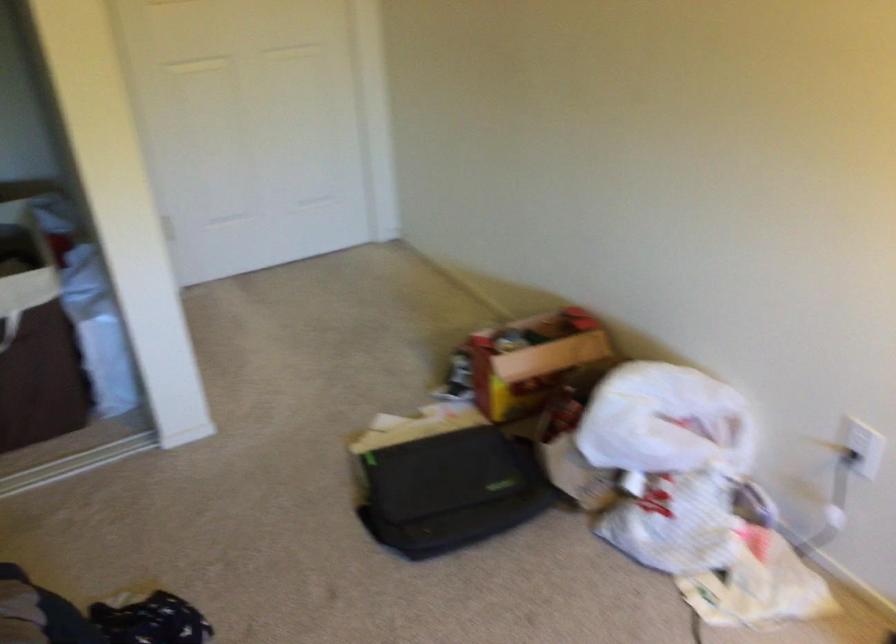
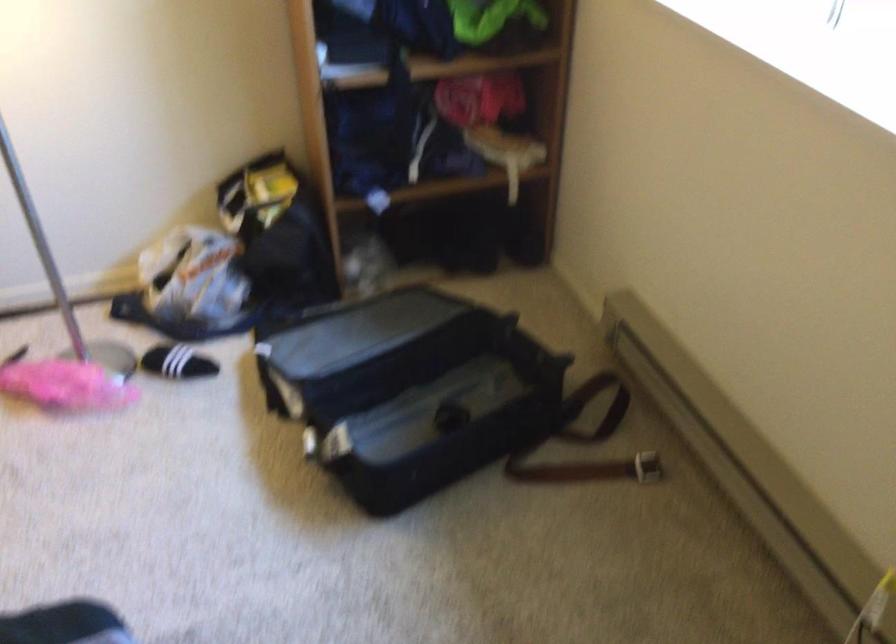
The images are taken continuously from a first-person perspective. In which direction is your viewpoint rotating?

The rotation direction of the camera is right-down.